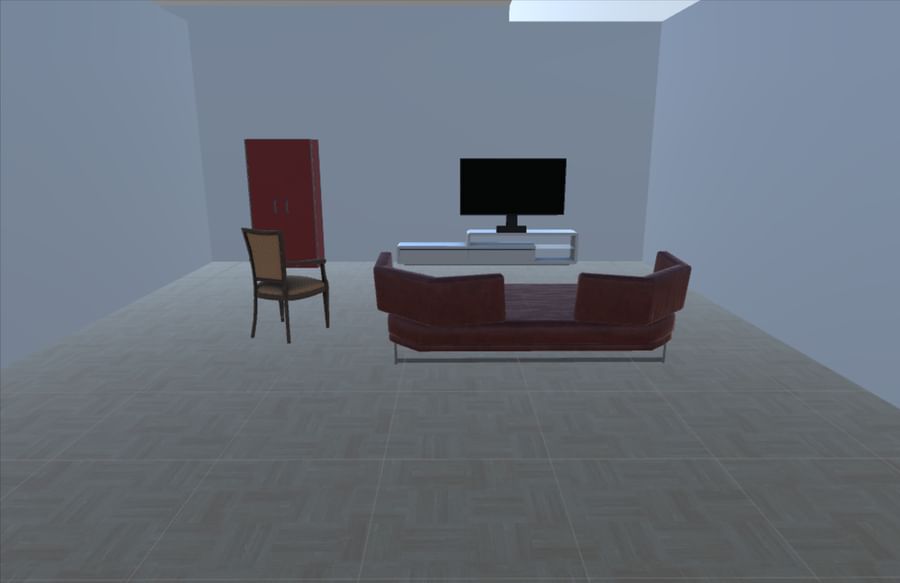
Locate an element on the screen. sofa is located at coordinates (429, 322).